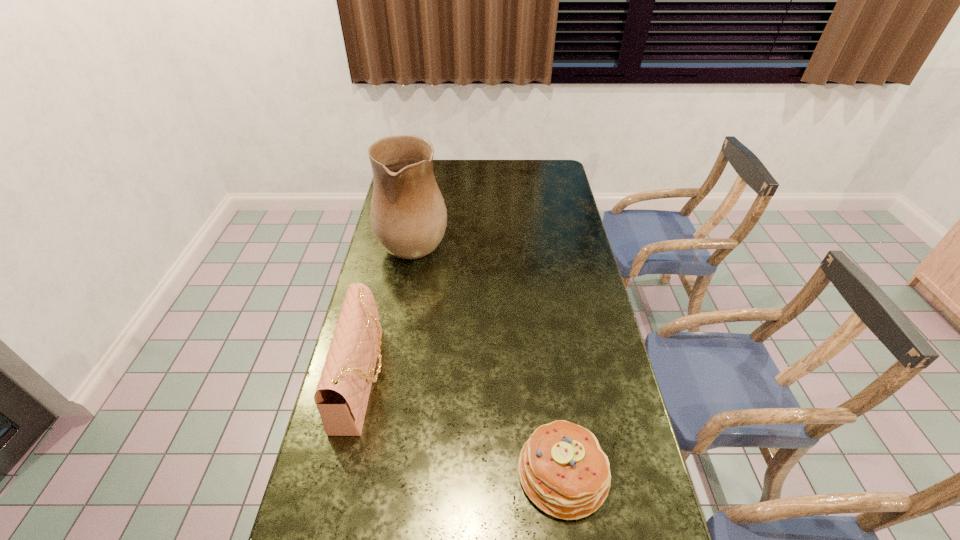
You are a GUI agent. You are given a task and a screenshot of the screen. Output one action in this format:
    pyautogui.click(x=<x>, y=<y>)
    Task: Click on the cream pitcher
    The height and width of the screenshot is (540, 960).
    Given the screenshot: What is the action you would take?
    pyautogui.click(x=408, y=215)

Locate an element on the screen. The image size is (960, 540). the farthest object is located at coordinates (408, 215).

This screenshot has height=540, width=960. What are the coordinates of `handbag` in the screenshot? It's located at (342, 394).

The height and width of the screenshot is (540, 960). I want to click on pancake, so click(562, 468).

Locate an element on the screen. the rightmost object is located at coordinates (562, 468).

You are a GUI agent. You are given a task and a screenshot of the screen. Output one action in this format:
    pyautogui.click(x=<x>, y=<y>)
    Task: Click on the free space located 0.050m at the spout of the cream pitcher
    The image size is (960, 540).
    Given the screenshot: What is the action you would take?
    pyautogui.click(x=462, y=238)

Where is `vacant area located on the front-facing side of the second shortest object`? The image size is (960, 540). vacant area located on the front-facing side of the second shortest object is located at coordinates (490, 379).

Identify the location of vacant space located 0.160m on the left of the rightmost object. (452, 472).

The height and width of the screenshot is (540, 960). What are the coordinates of `cream pitcher at the left edge` in the screenshot? It's located at (408, 215).

Identify the location of handbag situated at the left edge. Image resolution: width=960 pixels, height=540 pixels. (342, 394).